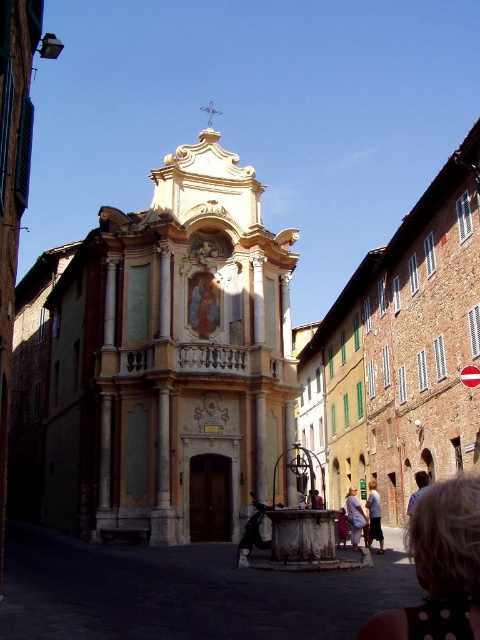
You are a delivery person carrying a package that requires a 4 meter clearance to pass through a narrow alley between the white cotton shirt at center and the light brown leather shoe at center. Will you be able to pass through without lowering the package?

The distance between the white cotton shirt at center and the light brown leather shoe at center is 3.54 meters, which is less than the required 4 meters clearance. Therefore, the delivery person will not be able to pass through without lowering the package.